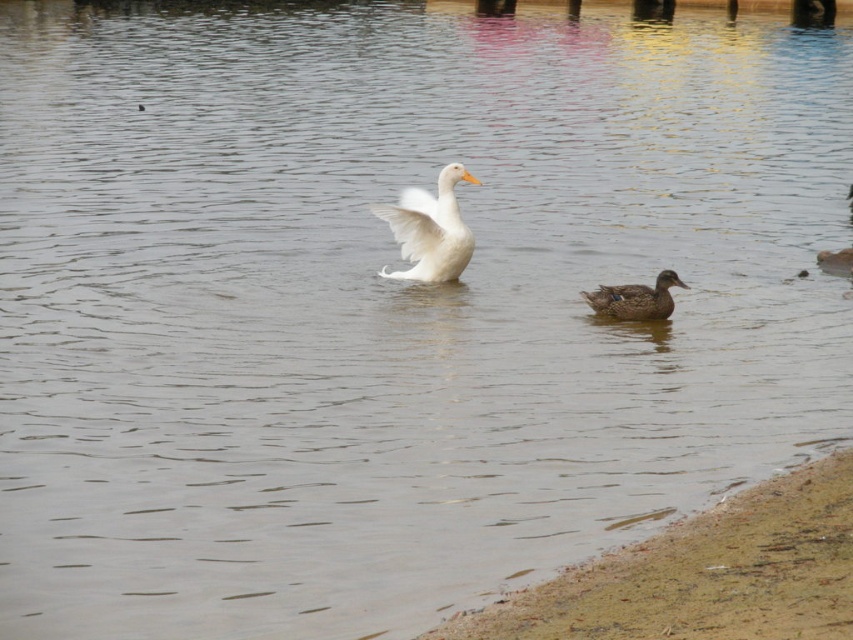
Question: Which point appears closest to the camera in this image?

Choices:
 (A) (602, 296)
 (B) (738, 548)
 (C) (422, 209)

Answer: (B)

Question: Among these points, which one is farthest from the camera?

Choices:
 (A) (444, 176)
 (B) (810, 600)

Answer: (A)

Question: Can you confirm if white feathered duck at center is positioned below dark brown glossy duck at lower right?

Choices:
 (A) yes
 (B) no

Answer: (B)

Question: Among these points, which one is nearest to the camera?

Choices:
 (A) (788, 513)
 (B) (641, 291)

Answer: (A)

Question: Is the position of brown sand at lower right less distant than that of white feathered duck at center?

Choices:
 (A) no
 (B) yes

Answer: (B)

Question: Can you confirm if white feathered duck at center is smaller than dark brown glossy duck at lower right?

Choices:
 (A) yes
 (B) no

Answer: (B)